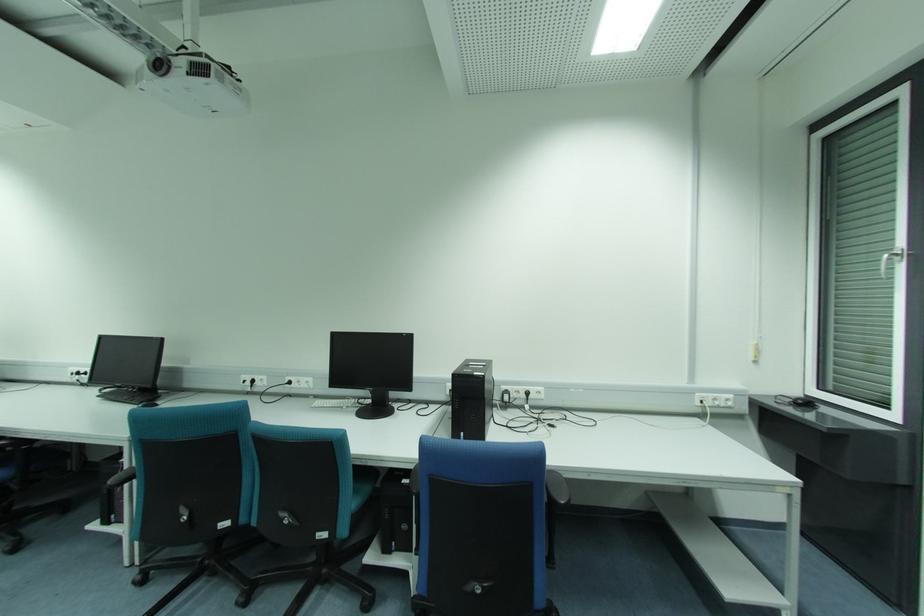
Image resolution: width=924 pixels, height=616 pixels. What do you see at coordinates (335, 403) in the screenshot?
I see `a white computer keyboard` at bounding box center [335, 403].